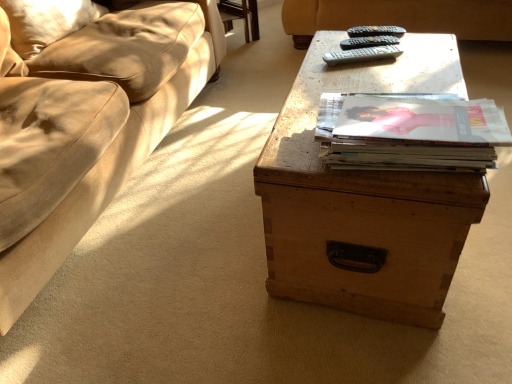
Image resolution: width=512 pixels, height=384 pixels. What do you see at coordinates (362, 54) in the screenshot? I see `gray plastic remote at upper center, which ranks as the first remote in bottom-to-top order` at bounding box center [362, 54].

This screenshot has height=384, width=512. I want to click on black plastic remote at upper center, the third remote positioned from the bottom, so click(375, 31).

Measure the distance between point (332, 229) and camera.

Point (332, 229) and camera are 93.00 centimeters apart.

Identify the location of black plastic remote at upper center, the second remote when ordered from bottom to top. pos(368,41).

The height and width of the screenshot is (384, 512). What do you see at coordinates (411, 131) in the screenshot?
I see `matte paper stack of magazines at center` at bounding box center [411, 131].

Locate an element on the screen. Image resolution: width=512 pixels, height=384 pixels. suede-like beige pillow at upper left is located at coordinates (46, 21).

Based on their positions, is wooden trunk at center located to the left or right of matte paper stack of magazines at center?

wooden trunk at center is to the right of matte paper stack of magazines at center.

What's the angular difference between wooden trunk at center and matte paper stack of magazines at center's facing directions?

There is a 5-degree angle between the facing directions of wooden trunk at center and matte paper stack of magazines at center.

Is wooden trunk at center inside or outside of matte paper stack of magazines at center?

wooden trunk at center lies outside matte paper stack of magazines at center.

Is the surface of wooden trunk at center in direct contact with matte paper stack of magazines at center?

They are not placed beside each other.

Is suede-like beige pillow at upper left inside black plastic remote at upper center, the third remote positioned from the bottom?

Actually, suede-like beige pillow at upper left is outside black plastic remote at upper center, the third remote positioned from the bottom.

From a real-world perspective, is black plastic remote at upper center, the third remote positioned from the bottom, above or below suede-like beige pillow at upper left?

Clearly, from a real-world perspective, black plastic remote at upper center, the third remote positioned from the bottom, is below suede-like beige pillow at upper left.

Which is behind, point (390, 33) or point (69, 0)?

Positioned behind is point (69, 0).

Is black plastic remote at upper center, the third remote positioned from the bottom, not close to suede-like beige pillow at upper left?

Yes, black plastic remote at upper center, the third remote positioned from the bottom, and suede-like beige pillow at upper left are located far from each other.

Can you confirm if black plastic remote at upper center, the 1th remote in the top-to-bottom sequence, is wider than wooden trunk at center?

In fact, black plastic remote at upper center, the 1th remote in the top-to-bottom sequence, might be narrower than wooden trunk at center.

Does black plastic remote at upper center, the third remote positioned from the bottom, have a greater height compared to wooden trunk at center?

No, black plastic remote at upper center, the third remote positioned from the bottom, is not taller than wooden trunk at center.

Consider the image. Would you say wooden trunk at center is part of black plastic remote at upper center, the 1th remote in the top-to-bottom sequence,'s contents?

No, wooden trunk at center is located outside of black plastic remote at upper center, the 1th remote in the top-to-bottom sequence.

Are black plastic remote at upper center, the third remote positioned from the bottom, and wooden trunk at center far apart?

No, black plastic remote at upper center, the third remote positioned from the bottom, is not far from wooden trunk at center.

Is black plastic remote at upper center, the third remote positioned from the bottom, completely or partially inside black plastic remote at upper center, arranged as the 2th remote when viewed from the top?

Definitely not — black plastic remote at upper center, the third remote positioned from the bottom, is not inside black plastic remote at upper center, arranged as the 2th remote when viewed from the top.

Does point (379, 41) come behind point (354, 34)?

No, it is in front of (354, 34).

Measure the distance from black plastic remote at upper center, the second remote when ordered from bottom to top, to black plastic remote at upper center, the third remote positioned from the bottom.

The distance of black plastic remote at upper center, the second remote when ordered from bottom to top, from black plastic remote at upper center, the third remote positioned from the bottom, is 1.28 inches.

Considering the positions of objects black plastic remote at upper center, arranged as the 2th remote when viewed from the top, and black plastic remote at upper center, the 1th remote in the top-to-bottom sequence, in the image provided, who is behind, black plastic remote at upper center, arranged as the 2th remote when viewed from the top, or black plastic remote at upper center, the 1th remote in the top-to-bottom sequence,?

black plastic remote at upper center, the 1th remote in the top-to-bottom sequence, is further away from the camera.

Who is more distant, gray plastic remote at upper center, which ranks as the 3th remote in top-to-bottom order, or black plastic remote at upper center, arranged as the 2th remote when viewed from the top?

black plastic remote at upper center, arranged as the 2th remote when viewed from the top, is further from the camera.

Does gray plastic remote at upper center, which ranks as the 3th remote in top-to-bottom order, appear on the left side of black plastic remote at upper center, arranged as the 2th remote when viewed from the top?

Indeed, gray plastic remote at upper center, which ranks as the 3th remote in top-to-bottom order, is positioned on the left side of black plastic remote at upper center, arranged as the 2th remote when viewed from the top.

Is gray plastic remote at upper center, which ranks as the first remote in bottom-to-top order, inside the boundaries of black plastic remote at upper center, the second remote when ordered from bottom to top, or outside?

gray plastic remote at upper center, which ranks as the first remote in bottom-to-top order, is spatially situated outside black plastic remote at upper center, the second remote when ordered from bottom to top.

Can you confirm if gray plastic remote at upper center, which ranks as the first remote in bottom-to-top order, is smaller than black plastic remote at upper center, the second remote when ordered from bottom to top?

Yes, gray plastic remote at upper center, which ranks as the first remote in bottom-to-top order, is smaller than black plastic remote at upper center, the second remote when ordered from bottom to top.

Is gray plastic remote at upper center, which ranks as the 3th remote in top-to-bottom order, taller or shorter than suede-like beige pillow at upper left?

Considering their sizes, gray plastic remote at upper center, which ranks as the 3th remote in top-to-bottom order, has less height than suede-like beige pillow at upper left.

Looking at this image, is gray plastic remote at upper center, which ranks as the first remote in bottom-to-top order, behind suede-like beige pillow at upper left?

No, it is in front of suede-like beige pillow at upper left.

From the picture: Is gray plastic remote at upper center, which ranks as the first remote in bottom-to-top order, facing away from suede-like beige pillow at upper left?

No.

Which is behind, point (343, 53) or point (71, 18)?

The point (71, 18) is more distant.

Does suede-like beige pillow at upper left have a lesser height compared to black plastic remote at upper center, arranged as the 2th remote when viewed from the top?

No.

Locate an element on the screen. The width and height of the screenshot is (512, 384). the 2nd remote to the right when counting from the suede-like beige pillow at upper left is located at coordinates click(368, 41).

From the picture: Is suede-like beige pillow at upper left smaller than black plastic remote at upper center, arranged as the 2th remote when viewed from the top?

No, suede-like beige pillow at upper left is not smaller than black plastic remote at upper center, arranged as the 2th remote when viewed from the top.

Can you confirm if suede-like beige pillow at upper left is wider than black plastic remote at upper center, arranged as the 2th remote when viewed from the top?

Yes.

Find the location of `table below the matte paper stack of magazines at center (from the image's perspective)`. table below the matte paper stack of magazines at center (from the image's perspective) is located at coordinates [x=364, y=197].

Locate an element on the screen. pillow behind the black plastic remote at upper center, the third remote positioned from the bottom is located at coordinates (46, 21).

Estimate the real-world distances between objects in this image. Which object is closer to suede-like beige pillow at upper left, black plastic remote at upper center, the 1th remote in the top-to-bottom sequence, or gray plastic remote at upper center, which ranks as the first remote in bottom-to-top order?

Based on the image, gray plastic remote at upper center, which ranks as the first remote in bottom-to-top order, appears to be nearer to suede-like beige pillow at upper left.

Which object lies further to the anchor point black plastic remote at upper center, the 1th remote in the top-to-bottom sequence, matte paper stack of magazines at center or wooden trunk at center?

The object further to black plastic remote at upper center, the 1th remote in the top-to-bottom sequence, is matte paper stack of magazines at center.

Which object lies nearer to the anchor point wooden trunk at center, gray plastic remote at upper center, which ranks as the 3th remote in top-to-bottom order, or black plastic remote at upper center, the 1th remote in the top-to-bottom sequence?

gray plastic remote at upper center, which ranks as the 3th remote in top-to-bottom order, is closer to wooden trunk at center.

Looking at the image, which one is located closer to matte paper stack of magazines at center, black plastic remote at upper center, the second remote when ordered from bottom to top, or wooden trunk at center?

wooden trunk at center.

When comparing their distances from gray plastic remote at upper center, which ranks as the 3th remote in top-to-bottom order, does suede-like beige pillow at upper left or black plastic remote at upper center, the 1th remote in the top-to-bottom sequence, seem further?

Based on the image, suede-like beige pillow at upper left appears to be further to gray plastic remote at upper center, which ranks as the 3th remote in top-to-bottom order.

When comparing their distances from black plastic remote at upper center, the 1th remote in the top-to-bottom sequence, does gray plastic remote at upper center, which ranks as the first remote in bottom-to-top order, or matte paper stack of magazines at center seem closer?

gray plastic remote at upper center, which ranks as the first remote in bottom-to-top order, is positioned closer to the anchor black plastic remote at upper center, the 1th remote in the top-to-bottom sequence.

Estimate the real-world distances between objects in this image. Which object is closer to gray plastic remote at upper center, which ranks as the 3th remote in top-to-bottom order, wooden trunk at center or black plastic remote at upper center, the third remote positioned from the bottom?

black plastic remote at upper center, the third remote positioned from the bottom, is closer to gray plastic remote at upper center, which ranks as the 3th remote in top-to-bottom order.

Based on their spatial positions, is black plastic remote at upper center, the third remote positioned from the bottom, or matte paper stack of magazines at center closer to gray plastic remote at upper center, which ranks as the first remote in bottom-to-top order?

black plastic remote at upper center, the third remote positioned from the bottom, lies closer to gray plastic remote at upper center, which ranks as the first remote in bottom-to-top order, than the other object.

The image size is (512, 384). I want to click on remote between matte paper stack of magazines at center and black plastic remote at upper center, arranged as the 2th remote when viewed from the top, along the z-axis, so click(362, 54).

Image resolution: width=512 pixels, height=384 pixels. What are the coordinates of `paperback book between suede-like beige pillow at upper left and black plastic remote at upper center, the third remote positioned from the bottom, from left to right` in the screenshot? It's located at (411, 131).

You are a GUI agent. You are given a task and a screenshot of the screen. Output one action in this format:
    pyautogui.click(x=<x>, y=<y>)
    Task: Click on the remote between black plastic remote at upper center, the third remote positioned from the bottom, and gray plastic remote at upper center, which ranks as the 3th remote in top-to-bottom order, in the vertical direction
    This screenshot has width=512, height=384.
    Given the screenshot: What is the action you would take?
    pyautogui.click(x=368, y=41)

The width and height of the screenshot is (512, 384). Find the location of `paperback book between suede-like beige pillow at upper left and black plastic remote at upper center, arranged as the 2th remote when viewed from the top, from left to right`. paperback book between suede-like beige pillow at upper left and black plastic remote at upper center, arranged as the 2th remote when viewed from the top, from left to right is located at coordinates (411, 131).